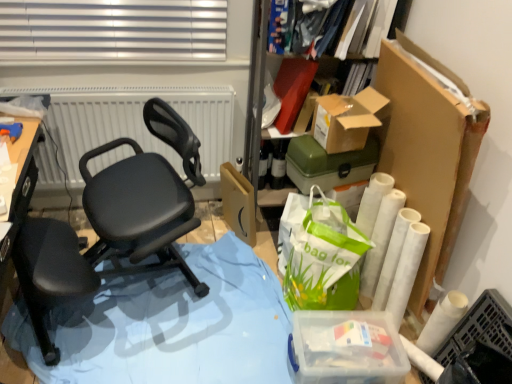
Question: Based on their sizes in the image, would you say matte white radiator at upper center is bigger or smaller than blue plastic table at lower left?

Choices:
 (A) small
 (B) big

Answer: (A)

Question: Considering the positions of matte white radiator at upper center and blue plastic table at lower left in the image, is matte white radiator at upper center taller or shorter than blue plastic table at lower left?

Choices:
 (A) tall
 (B) short

Answer: (A)

Question: Which object is positioned closest to the matte brown cardboard box at center?

Choices:
 (A) green plastic storage box at upper right, placed as the first storage box when sorted from top to bottom
 (B) clear plastic container at lower right, which ranks as the 2th storage box in top-to-bottom order
 (C) blue plastic table at lower left
 (D) matte black office chair at center
 (E) cardboard box at upper right

Answer: (A)

Question: Which object is positioned farthest from the blue plastic table at lower left?

Choices:
 (A) matte black office chair at center
 (B) green plastic storage box at upper right, the 2th storage box positioned from the bottom
 (C) clear plastic container at lower right, which ranks as the 2th storage box in top-to-bottom order
 (D) matte brown cardboard box at center
 (E) matte white radiator at upper center

Answer: (E)